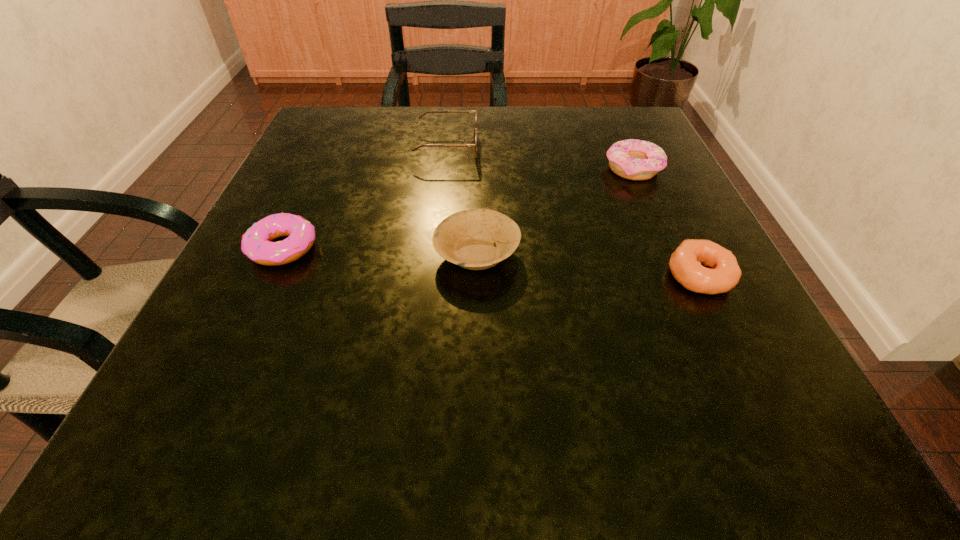
Image resolution: width=960 pixels, height=540 pixels. I want to click on free point between the farthest doughnut and the leftmost doughnut, so click(x=458, y=208).

Locate which object is the fourth closest to the farthest doughnut. Please provide its 2D coordinates. Your answer should be formatted as a tuple, i.e. [(x, y)], where the tuple contains the x and y coordinates of a point satisfying the conditions above.

[(256, 244)]

Locate which object is the second closest to the bowl. Please provide its 2D coordinates. Your answer should be formatted as a tuple, i.e. [(x, y)], where the tuple contains the x and y coordinates of a point satisfying the conditions above.

[(475, 130)]

Locate which doughnut is the second closest to the farthest doughnut. Please provide its 2D coordinates. Your answer should be formatted as a tuple, i.e. [(x, y)], where the tuple contains the x and y coordinates of a point satisfying the conditions above.

[(256, 244)]

Point out which doughnut is positioned as the third nearest to the spectacles. Please provide its 2D coordinates. Your answer should be formatted as a tuple, i.e. [(x, y)], where the tuple contains the x and y coordinates of a point satisfying the conditions above.

[(685, 263)]

Identify the location of blank space that satisfies the following two spatial constraints: 1. at the front view of the farthest doughnut; 2. on the left side of the spectacles. (444, 168).

At what (x,y) coordinates should I click in order to perform the action: click on vacant space that satisfies the following two spatial constraints: 1. at the front view of the bowl; 2. on the left side of the spectacles. Please return your answer as a coordinate pair (x, y). Looking at the image, I should click on (436, 254).

Identify the location of free space that satisfies the following two spatial constraints: 1. at the front view of the spectacles; 2. on the right side of the farthest doughnut. Image resolution: width=960 pixels, height=540 pixels. (444, 168).

You are a GUI agent. You are given a task and a screenshot of the screen. Output one action in this format:
    pyautogui.click(x=<x>, y=<y>)
    Task: Click on the free space that satisfies the following two spatial constraints: 1. at the front view of the spectacles; 2. on the left side of the bowl
    The image size is (960, 540).
    Given the screenshot: What is the action you would take?
    tap(436, 254)

Where is `vacant space that satisfies the following two spatial constraints: 1. on the back side of the farthest doughnut; 2. on the left side of the bowl`? vacant space that satisfies the following two spatial constraints: 1. on the back side of the farthest doughnut; 2. on the left side of the bowl is located at coordinates click(477, 168).